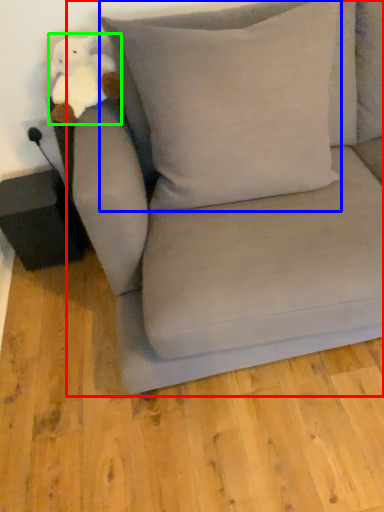
Question: Which object is positioned closest to studio couch (highlighted by a red box)? Select from pillow (highlighted by a blue box) and toy (highlighted by a green box).

Choices:
 (A) pillow
 (B) toy

Answer: (A)